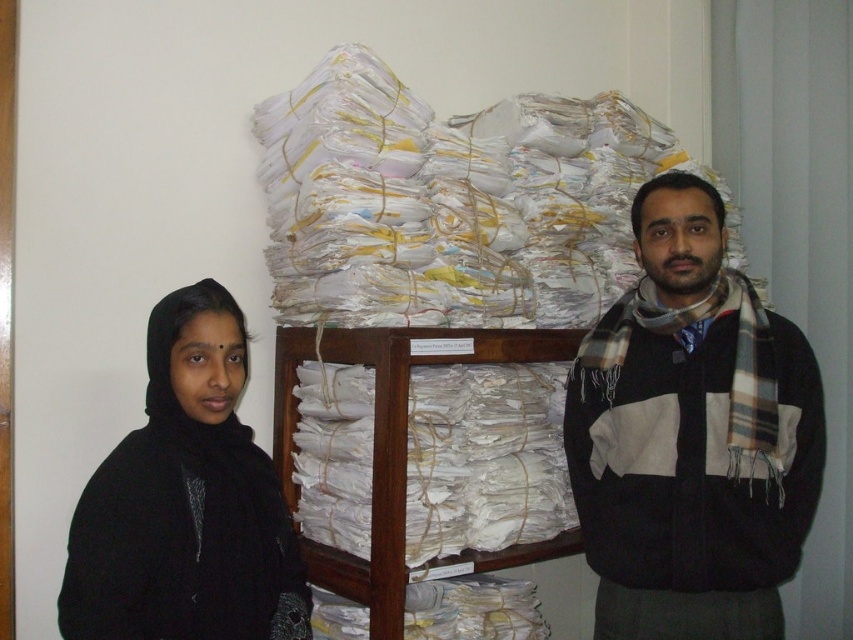
Does plaid scarf at right appear on the right side of black matte/black fabric at left?

Correct, you'll find plaid scarf at right to the right of black matte/black fabric at left.

Between plaid scarf at right and black matte/black fabric at left, which one appears on the right side from the viewer's perspective?

From the viewer's perspective, plaid scarf at right appears more on the right side.

Which is in front, point (595, 477) or point (235, 515)?

Point (235, 515) is more forward.

The height and width of the screenshot is (640, 853). What are the coordinates of `plaid scarf at right` in the screenshot? It's located at (689, 442).

Is white paper at center above plaid scarf at right?

Yes.

Who is more forward, (294, 131) or (619, 300)?

Positioned in front is point (619, 300).

Does point (344, 288) lie behind point (816, 416)?

Yes, point (344, 288) is behind point (816, 416).

The image size is (853, 640). In order to click on white paper at center in this screenshot , I will do `click(453, 202)`.

Is white paper at center bigger than black matte/black fabric at left?

Yes, white paper at center is bigger than black matte/black fabric at left.

Which is more to the right, white paper at center or black matte/black fabric at left?

white paper at center is more to the right.

Who is more forward, (334,202) or (129,625)?

Point (129,625)

Locate an element on the screen. The image size is (853, 640). white paper at center is located at coordinates (453, 202).